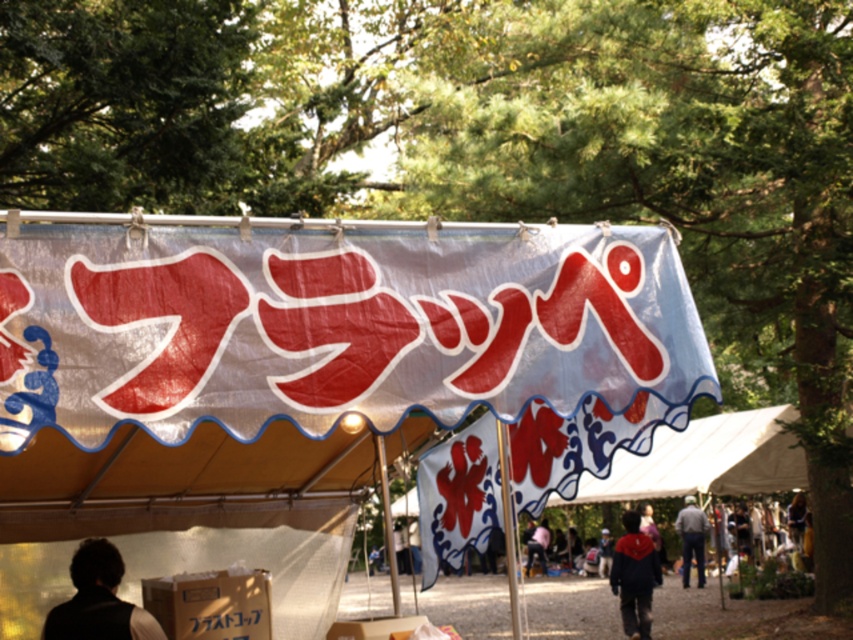
You are a photographer positioned at the dark brown hair at lower left and want to take a photo of the gray fabric jacket at lower right. If your camera has a maximum focus range of 30 meters, will you be able to capture the jacket clearly?

The distance between dark brown hair at lower left and gray fabric jacket at lower right is 29.99 meters, which is just under the camera maximum focus range of 30 meters. Therefore, you can capture the jacket clearly.

You are a festival attendee standing under the canopy and want to touch both the white fabric tent at center and the red velvet cape at center. Which object should you reach for first to touch the one closer to you?

The white fabric tent at center is closer to the viewer, so you should reach for it first.